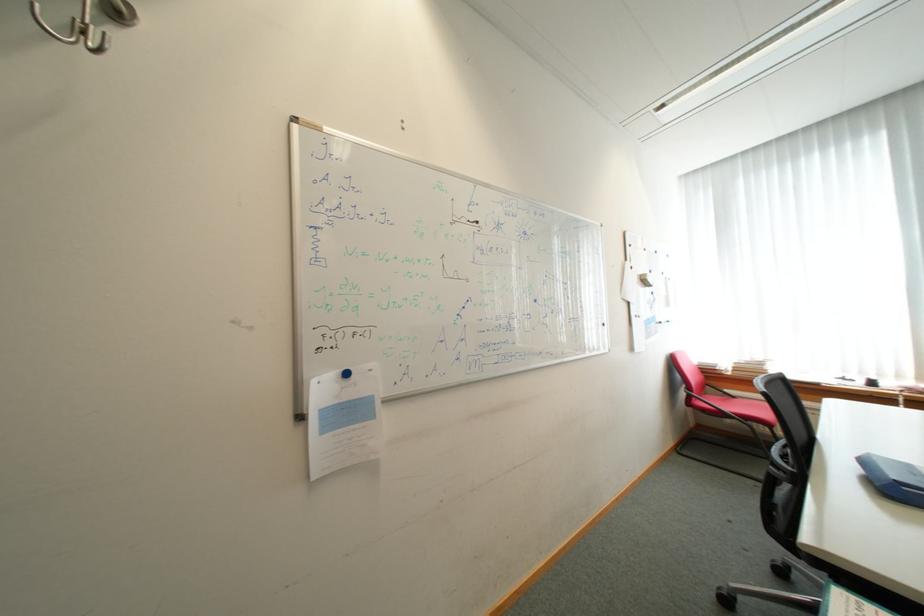
Find the location of a particular element. The width and height of the screenshot is (924, 616). chair sitting surface is located at coordinates (789, 508).